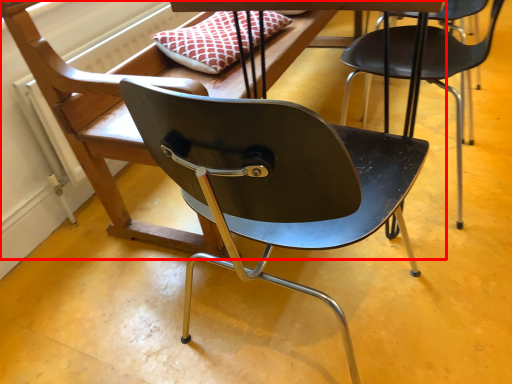
Question: From the image's perspective, where is chair (annotated by the red box) located relative to chair?

Choices:
 (A) above
 (B) below

Answer: (B)